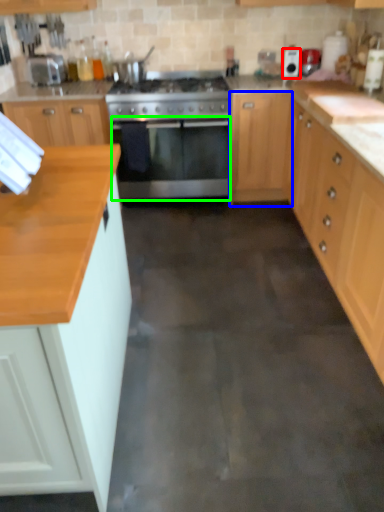
Question: Which object is positioned closest to appliance (highlighted by a red box)? Select from cabinetry (highlighted by a blue box) and oven (highlighted by a green box).

Choices:
 (A) cabinetry
 (B) oven

Answer: (A)